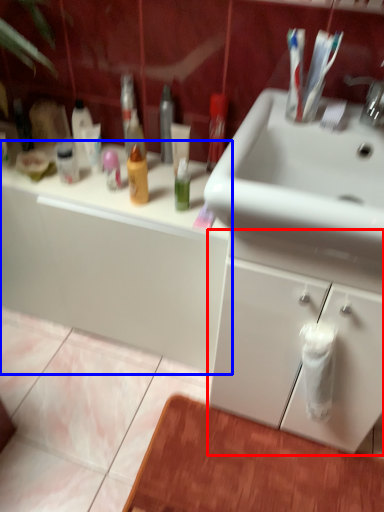
Question: Which object appears closest to the camera in this image, bathroom cabinet (highlighted by a red box) or bathroom cabinet (highlighted by a blue box)?

Choices:
 (A) bathroom cabinet
 (B) bathroom cabinet

Answer: (A)